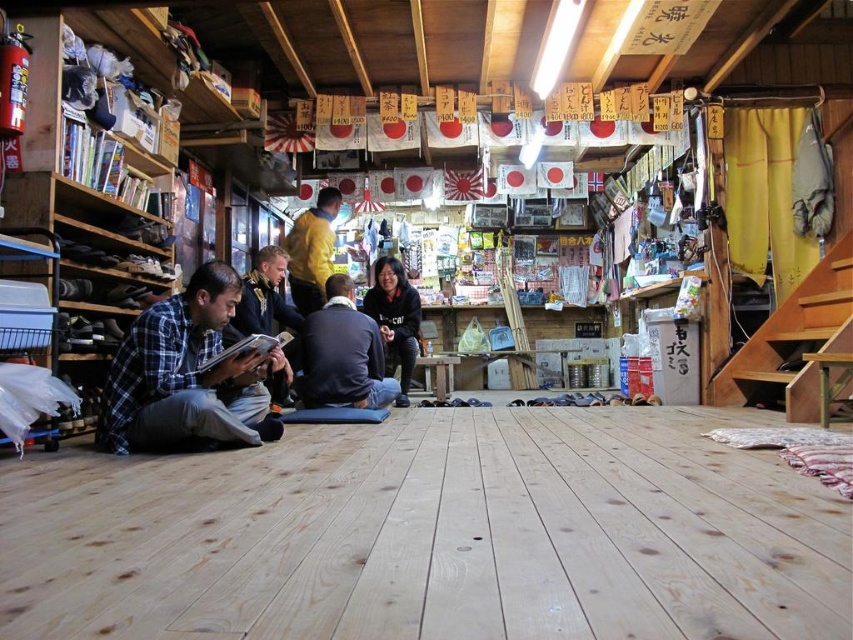
Image resolution: width=853 pixels, height=640 pixels. I want to click on black matte jacket at center, so click(395, 320).

Who is higher up, black matte jacket at center or yellow matte shirt at center?

yellow matte shirt at center is higher up.

What do you see at coordinates (395, 320) in the screenshot? I see `black matte jacket at center` at bounding box center [395, 320].

Find the location of a particular element. Image resolution: width=853 pixels, height=640 pixels. black matte jacket at center is located at coordinates (395, 320).

Can you confirm if golden leather jacket at center is positioned to the left of yellow matte shirt at center?

Indeed, golden leather jacket at center is positioned on the left side of yellow matte shirt at center.

Does golden leather jacket at center appear on the right side of yellow matte shirt at center?

In fact, golden leather jacket at center is to the left of yellow matte shirt at center.

Image resolution: width=853 pixels, height=640 pixels. I want to click on golden leather jacket at center, so click(263, 298).

Locate an element on the screen. The width and height of the screenshot is (853, 640). plaid fabric shirt at lower left is located at coordinates (186, 376).

Measure the distance between point (149, 428) and camera.

They are 8.77 feet apart.

Is point (138, 356) less distant than point (267, 317)?

Yes, it is.

Identify the location of plaid fabric shirt at lower left. (186, 376).